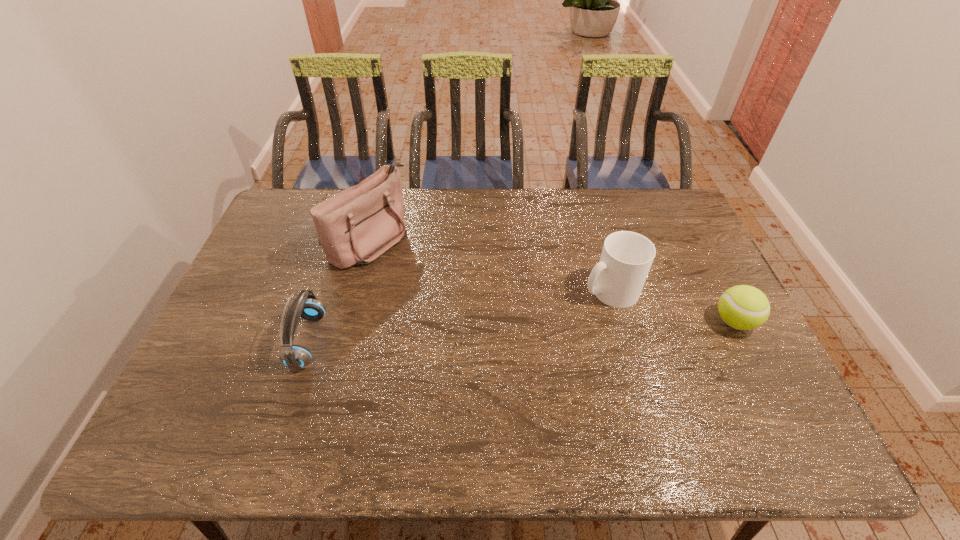
Locate an element on the screen. The image size is (960, 540). free space at the far right corner of the desktop is located at coordinates (640, 193).

I want to click on free point between the second shortest object and the tallest object, so click(x=339, y=291).

Where is `free point between the headset and the third shortest object`? free point between the headset and the third shortest object is located at coordinates (459, 316).

This screenshot has height=540, width=960. Identify the location of free spot between the second shortest object and the farthest object. (339, 291).

Identify the location of free space that is in between the third tallest object and the rightmost object. This screenshot has width=960, height=540. (521, 332).

Where is `empty space between the tennis ball and the headset`? empty space between the tennis ball and the headset is located at coordinates (521, 332).

Identify the location of blank region between the tennis ball and the second tallest object. The height and width of the screenshot is (540, 960). (672, 306).

This screenshot has height=540, width=960. Find the location of `free point between the third tallest object and the rightmost object`. free point between the third tallest object and the rightmost object is located at coordinates click(x=521, y=332).

What are the coordinates of `vacant area between the tallest object and the third object from left to right` in the screenshot? It's located at (490, 265).

You are a GUI agent. You are given a task and a screenshot of the screen. Output one action in this format:
    pyautogui.click(x=<x>, y=<y>)
    Task: Click on the vacant space that is in between the mug and the rightmost object
    The height and width of the screenshot is (540, 960).
    Given the screenshot: What is the action you would take?
    pyautogui.click(x=672, y=306)